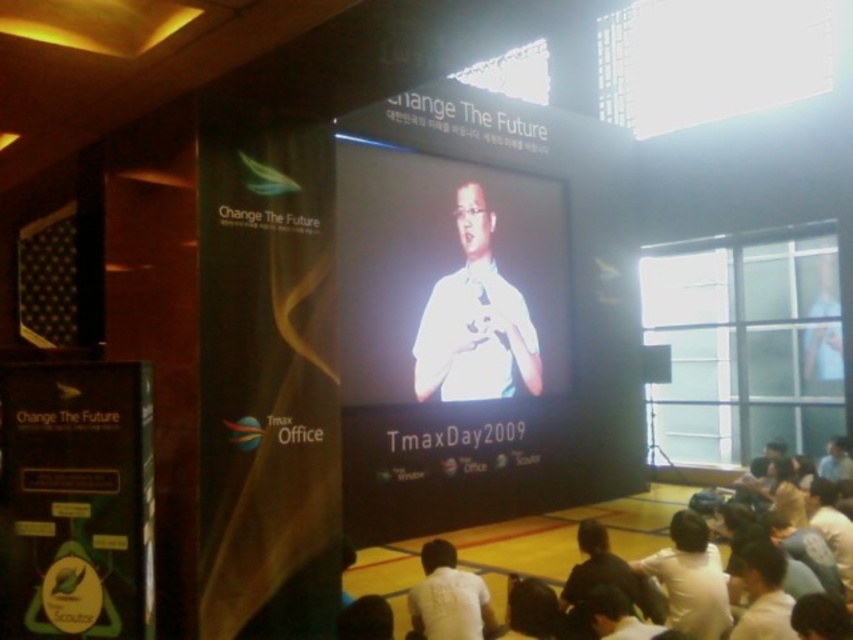
Consider the image. You are an event photographer at the conference. You need to capture a photo of both the white cotton shirt at lower center and the white matte shirt at center. Which shirt should you zoom in on to ensure both fit in the frame?

The white cotton shirt at lower center is wider than the white matte shirt at center, so you should zoom out to ensure both fit in the frame. However, if you must zoom in, focus on the white matte shirt at center since it is narrower and will still fit within the frame while including the wider shirt partially.

You are organizing a presentation and need to place a decorative banner between the white glossy screen at center and the white cotton shirt at lower center. Which object should the banner be placed closer to if you want it to be closer to the narrower object?

The banner should be placed closer to the white glossy screen at center because it has a lesser width compared to the white cotton shirt at lower center.

You are an event photographer at the TmaxDay2009 conference. You need to capture a clear photo of the speaker on the large screen while also including both the white cotton shirt at lower center and the white matte shirt at center in the frame. Which shirt should you focus on to ensure both are visible without one blocking the other?

The white cotton shirt at lower center is in front of the white matte shirt at center. To ensure both are visible without one blocking the other, focus on the white cotton shirt at lower center first, as it is closer to the camera, and adjust the framing so the white matte shirt at center is visible behind it.